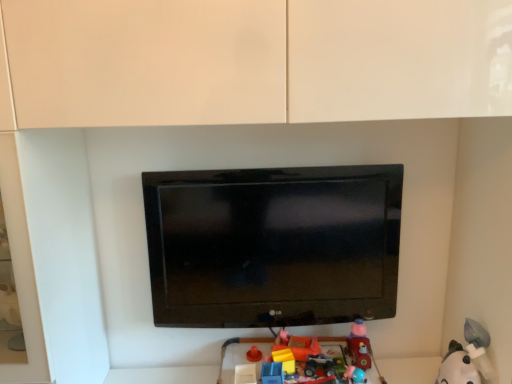
What is the approximate height of black glossy tv at center?

black glossy tv at center is 21.72 inches in height.

In order to face white plush toy at lower right, placed as the 4th toy when sorted from left to right, should I rotate leftwards or rightwards?

To align with it, rotate right about 25.204°.

Measure the distance between rubberized plastic toy at lower center, which is the second toy in left-to-right order, and camera.

A distance of 1.38 meters exists between rubberized plastic toy at lower center, which is the second toy in left-to-right order, and camera.

I want to click on matte plastic toy car at lower right, positioned as the 2th toy in right-to-left order, so click(359, 345).

Measure the distance between blue plastic toy at lower center, acting as the first toy starting from the left, and camera.

blue plastic toy at lower center, acting as the first toy starting from the left, and camera are 1.30 meters apart.

Find the location of a particular element. This screenshot has width=512, height=384. black glossy tv at center is located at coordinates (273, 245).

Which is more to the right, matte plastic toy car at lower right, positioned as the 2th toy in right-to-left order, or white plush toy at lower right, which is the first toy from right to left?

white plush toy at lower right, which is the first toy from right to left, is more to the right.

Is matte plastic toy car at lower right, the 3th toy positioned from the left, aimed at white plush toy at lower right, placed as the 4th toy when sorted from left to right?

No, matte plastic toy car at lower right, the 3th toy positioned from the left, is not turned towards white plush toy at lower right, placed as the 4th toy when sorted from left to right.

Is matte plastic toy car at lower right, positioned as the 2th toy in right-to-left order, placed right next to white plush toy at lower right, placed as the 4th toy when sorted from left to right?

They are not placed beside each other.

Based on the photo, from a real-world perspective, who is located higher, matte plastic toy car at lower right, positioned as the 2th toy in right-to-left order, or white plush toy at lower right, placed as the 4th toy when sorted from left to right?

From a 3D spatial view, matte plastic toy car at lower right, positioned as the 2th toy in right-to-left order, is above.

Locate an element on the screen. This screenshot has width=512, height=384. toy below the white plush toy at lower right, placed as the 4th toy when sorted from left to right (from the image's perspective) is located at coordinates (241, 342).

From the image's perspective, does rubberized plastic toy at lower center, which is the 3th toy from right to left, appear lower than white plush toy at lower right, placed as the 4th toy when sorted from left to right?

Correct, rubberized plastic toy at lower center, which is the 3th toy from right to left, appears lower than white plush toy at lower right, placed as the 4th toy when sorted from left to right, in the image.

Considering the sizes of objects rubberized plastic toy at lower center, which is the second toy in left-to-right order, and white plush toy at lower right, which is the first toy from right to left, in the image provided, who is smaller, rubberized plastic toy at lower center, which is the second toy in left-to-right order, or white plush toy at lower right, which is the first toy from right to left,?

Smaller between the two is white plush toy at lower right, which is the first toy from right to left.

Considering the sizes of objects rubberized plastic toy at lower center, which is the second toy in left-to-right order, and white plush toy at lower right, which is the first toy from right to left, in the image provided, who is wider, rubberized plastic toy at lower center, which is the second toy in left-to-right order, or white plush toy at lower right, which is the first toy from right to left,?

rubberized plastic toy at lower center, which is the second toy in left-to-right order, is wider.

From a real-world perspective, is rubberized plastic toy at lower center, which is the second toy in left-to-right order, below matte plastic toy car at lower right, positioned as the 2th toy in right-to-left order?

Correct, in the physical world, rubberized plastic toy at lower center, which is the second toy in left-to-right order, is lower than matte plastic toy car at lower right, positioned as the 2th toy in right-to-left order.

Does rubberized plastic toy at lower center, which is the second toy in left-to-right order, appear on the left side of matte plastic toy car at lower right, the 3th toy positioned from the left?

Yes, rubberized plastic toy at lower center, which is the second toy in left-to-right order, is to the left of matte plastic toy car at lower right, the 3th toy positioned from the left.

Could you measure the distance between rubberized plastic toy at lower center, which is the second toy in left-to-right order, and matte plastic toy car at lower right, the 3th toy positioned from the left?

rubberized plastic toy at lower center, which is the second toy in left-to-right order, and matte plastic toy car at lower right, the 3th toy positioned from the left, are 5.33 inches apart from each other.

Is point (323, 337) closer or farther from the camera than point (364, 369)?

Point (323, 337) is positioned farther from the camera compared to point (364, 369).

Considering the sizes of objects rubberized plastic toy at lower center, which is the second toy in left-to-right order, and black glossy tv at center in the image provided, who is smaller, rubberized plastic toy at lower center, which is the second toy in left-to-right order, or black glossy tv at center?

With smaller size is rubberized plastic toy at lower center, which is the second toy in left-to-right order.

Which object is positioned more to the right, rubberized plastic toy at lower center, which is the 3th toy from right to left, or black glossy tv at center?

Positioned to the right is rubberized plastic toy at lower center, which is the 3th toy from right to left.

From a real-world perspective, who is located lower, rubberized plastic toy at lower center, which is the 3th toy from right to left, or black glossy tv at center?

From a 3D spatial view, rubberized plastic toy at lower center, which is the 3th toy from right to left, is below.

Identify the location of television located above the rubberized plastic toy at lower center, which is the 3th toy from right to left (from the image's perspective). The width and height of the screenshot is (512, 384). point(273,245).

Which toy is the 1st one when counting from the right side of the black glossy tv at center? Please provide its 2D coordinates.

[(241, 342)]

From a real-world perspective, is black glossy tv at center on top of rubberized plastic toy at lower center, which is the second toy in left-to-right order?

Yes, from a real-world perspective, black glossy tv at center is above rubberized plastic toy at lower center, which is the second toy in left-to-right order.

Measure the distance from black glossy tv at center to rubberized plastic toy at lower center, which is the second toy in left-to-right order.

black glossy tv at center is 12.52 inches from rubberized plastic toy at lower center, which is the second toy in left-to-right order.

Is black glossy tv at center completely or partially outside of rubberized plastic toy at lower center, which is the 3th toy from right to left?

That's correct, black glossy tv at center is outside of rubberized plastic toy at lower center, which is the 3th toy from right to left.

Is blue plastic toy at lower center, marked as the 4th toy in a right-to-left arrangement, facing towards matte plastic toy car at lower right, the 3th toy positioned from the left?

No, blue plastic toy at lower center, marked as the 4th toy in a right-to-left arrangement, is not oriented towards matte plastic toy car at lower right, the 3th toy positioned from the left.

In terms of height, does blue plastic toy at lower center, marked as the 4th toy in a right-to-left arrangement, look taller or shorter compared to matte plastic toy car at lower right, the 3th toy positioned from the left?

In the image, blue plastic toy at lower center, marked as the 4th toy in a right-to-left arrangement, appears to be shorter than matte plastic toy car at lower right, the 3th toy positioned from the left.

This screenshot has width=512, height=384. Identify the location of the 2nd toy behind the blue plastic toy at lower center, acting as the first toy starting from the left, counting from the anchor's position. (359, 345).

Is there a large distance between blue plastic toy at lower center, acting as the first toy starting from the left, and matte plastic toy car at lower right, positioned as the 2th toy in right-to-left order?

No, blue plastic toy at lower center, acting as the first toy starting from the left, is not far from matte plastic toy car at lower right, positioned as the 2th toy in right-to-left order.

Considering the relative sizes of black glossy tv at center and matte plastic toy car at lower right, positioned as the 2th toy in right-to-left order, in the image provided, is black glossy tv at center bigger than matte plastic toy car at lower right, positioned as the 2th toy in right-to-left order,?

Indeed, black glossy tv at center has a larger size compared to matte plastic toy car at lower right, positioned as the 2th toy in right-to-left order.

Relative to matte plastic toy car at lower right, positioned as the 2th toy in right-to-left order, is black glossy tv at center in front or behind?

black glossy tv at center is positioned closer to the viewer than matte plastic toy car at lower right, positioned as the 2th toy in right-to-left order.

Could you tell me if black glossy tv at center is facing matte plastic toy car at lower right, positioned as the 2th toy in right-to-left order?

Yes.

From a real-world perspective, is black glossy tv at center under matte plastic toy car at lower right, the 3th toy positioned from the left?

No, from a real-world perspective, black glossy tv at center is not under matte plastic toy car at lower right, the 3th toy positioned from the left.

Identify the location of the 3rd toy in front of the matte plastic toy car at lower right, the 3th toy positioned from the left, starting your count from the anchor. (467, 358).

This screenshot has width=512, height=384. I want to click on the 1st toy above when counting from the rubberized plastic toy at lower center, which is the 3th toy from right to left (from the image's perspective), so click(x=467, y=358).

From the image, which object appears to be farther from matte plastic toy car at lower right, positioned as the 2th toy in right-to-left order, rubberized plastic toy at lower center, which is the 3th toy from right to left, or blue plastic toy at lower center, marked as the 4th toy in a right-to-left arrangement?

Among the two, blue plastic toy at lower center, marked as the 4th toy in a right-to-left arrangement, is located further to matte plastic toy car at lower right, positioned as the 2th toy in right-to-left order.

From the image, which object appears to be nearer to black glossy tv at center, white plush toy at lower right, which is the first toy from right to left, or rubberized plastic toy at lower center, which is the 3th toy from right to left?

The object closer to black glossy tv at center is rubberized plastic toy at lower center, which is the 3th toy from right to left.

Looking at the image, which one is located further to black glossy tv at center, matte plastic toy car at lower right, the 3th toy positioned from the left, or blue plastic toy at lower center, acting as the first toy starting from the left?

blue plastic toy at lower center, acting as the first toy starting from the left, lies further to black glossy tv at center than the other object.

Based on the photo, based on their spatial positions, is matte plastic toy car at lower right, the 3th toy positioned from the left, or white plush toy at lower right, which is the first toy from right to left, further from black glossy tv at center?

The object further to black glossy tv at center is white plush toy at lower right, which is the first toy from right to left.

Looking at the image, which one is located further to black glossy tv at center, rubberized plastic toy at lower center, which is the second toy in left-to-right order, or white plush toy at lower right, placed as the 4th toy when sorted from left to right?

The object further to black glossy tv at center is white plush toy at lower right, placed as the 4th toy when sorted from left to right.

When comparing their distances from white plush toy at lower right, which is the first toy from right to left, does blue plastic toy at lower center, marked as the 4th toy in a right-to-left arrangement, or black glossy tv at center seem further?

black glossy tv at center is further to white plush toy at lower right, which is the first toy from right to left.

Which object lies further to the anchor point black glossy tv at center, blue plastic toy at lower center, acting as the first toy starting from the left, or rubberized plastic toy at lower center, which is the second toy in left-to-right order?

blue plastic toy at lower center, acting as the first toy starting from the left, is further to black glossy tv at center.

Considering their positions, is black glossy tv at center positioned closer to matte plastic toy car at lower right, positioned as the 2th toy in right-to-left order, than white plush toy at lower right, which is the first toy from right to left?

Based on the image, white plush toy at lower right, which is the first toy from right to left, appears to be nearer to matte plastic toy car at lower right, positioned as the 2th toy in right-to-left order.

Where is `television between blue plastic toy at lower center, acting as the first toy starting from the left, and white plush toy at lower right, which is the first toy from right to left, from left to right`? The width and height of the screenshot is (512, 384). television between blue plastic toy at lower center, acting as the first toy starting from the left, and white plush toy at lower right, which is the first toy from right to left, from left to right is located at coordinates (273, 245).

The height and width of the screenshot is (384, 512). I want to click on toy located between blue plastic toy at lower center, marked as the 4th toy in a right-to-left arrangement, and matte plastic toy car at lower right, positioned as the 2th toy in right-to-left order, in the left-right direction, so click(x=241, y=342).

You are a GUI agent. You are given a task and a screenshot of the screen. Output one action in this format:
    pyautogui.click(x=<x>, y=<y>)
    Task: Click on the toy that lies between black glossy tv at center and blue plastic toy at lower center, marked as the 4th toy in a right-to-left arrangement, from top to bottom
    
    Given the screenshot: What is the action you would take?
    pos(359,345)

Where is `toy between rubberized plastic toy at lower center, which is the 3th toy from right to left, and white plush toy at lower right, which is the first toy from right to left`? The height and width of the screenshot is (384, 512). toy between rubberized plastic toy at lower center, which is the 3th toy from right to left, and white plush toy at lower right, which is the first toy from right to left is located at coordinates (359, 345).